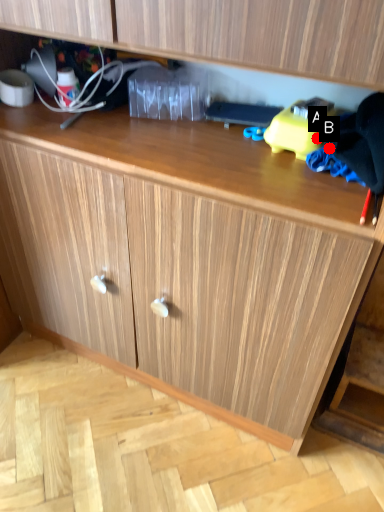
Question: Two points are circled on the image, labeled by A and B beside each circle. Which point is closer to the camera taking this photo?

Choices:
 (A) A is closer
 (B) B is closer

Answer: (B)